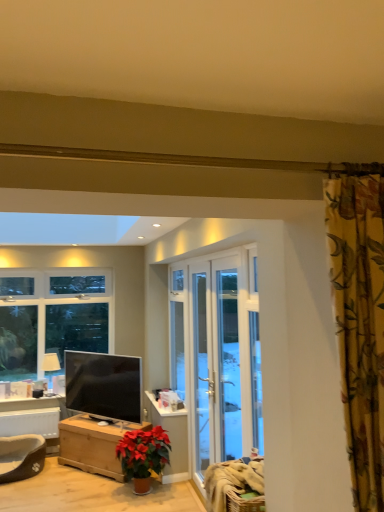
The image size is (384, 512). What do you see at coordinates (33, 418) in the screenshot?
I see `white painted wood table at lower left` at bounding box center [33, 418].

Describe the element at coordinates (21, 457) in the screenshot. The width and height of the screenshot is (384, 512). I see `dark brown plush pet bed at lower left` at that location.

Image resolution: width=384 pixels, height=512 pixels. What do you see at coordinates (93, 444) in the screenshot?
I see `wooden chest at lower left` at bounding box center [93, 444].

Measure the distance between white glass door at center, positioned as the first screen door in back-to-front order, and camera.

white glass door at center, positioned as the first screen door in back-to-front order, is 3.42 meters away from camera.

In order to face matte black tv at lower left, should I rotate leftwards or rightwards?

To face it directly, rotate left by 12.116 degrees.

You are a GUI agent. You are given a task and a screenshot of the screen. Output one action in this format:
    pyautogui.click(x=<x>, y=<y>)
    Task: Click on the matte black tv at lower left
    The height and width of the screenshot is (512, 384).
    Given the screenshot: What is the action you would take?
    pyautogui.click(x=104, y=385)

The width and height of the screenshot is (384, 512). What are the coordinates of `matte white lamp at left` in the screenshot? It's located at (50, 365).

Is dark brown plush pet bed at lower left to the left or to the right of matte white lamp at left in the image?

Based on their positions, dark brown plush pet bed at lower left is located to the left of matte white lamp at left.

Considering the sizes of objects dark brown plush pet bed at lower left and matte white lamp at left in the image provided, who is shorter, dark brown plush pet bed at lower left or matte white lamp at left?

Standing shorter between the two is dark brown plush pet bed at lower left.

Is dark brown plush pet bed at lower left not near matte white lamp at left?

dark brown plush pet bed at lower left is near matte white lamp at left, not far away.

From the image's perspective, is dark brown plush pet bed at lower left over matte white lamp at left?

No, from the image's perspective, dark brown plush pet bed at lower left is not on top of matte white lamp at left.

Is dark brown plush pet bed at lower left beside white glass door at center, the 2th screen door viewed from the front?

No, dark brown plush pet bed at lower left is not with white glass door at center, the 2th screen door viewed from the front.

Which of these two, dark brown plush pet bed at lower left or white glass door at center, positioned as the first screen door in back-to-front order, stands taller?

With more height is white glass door at center, positioned as the first screen door in back-to-front order.

Based on the photo, based on their sizes in the image, would you say dark brown plush pet bed at lower left is bigger or smaller than white glass door at center, positioned as the first screen door in back-to-front order?

In the image, dark brown plush pet bed at lower left appears to be smaller than white glass door at center, positioned as the first screen door in back-to-front order.

Does dark brown plush pet bed at lower left lie behind white glass door at center, positioned as the first screen door in back-to-front order?

Yes, the depth of dark brown plush pet bed at lower left is greater than that of white glass door at center, positioned as the first screen door in back-to-front order.

Who is bigger, wooden chest at lower left or dark brown plush pet bed at lower left?

wooden chest at lower left.

Is wooden chest at lower left situated inside dark brown plush pet bed at lower left or outside?

wooden chest at lower left is spatially situated outside dark brown plush pet bed at lower left.

From the image's perspective, is wooden chest at lower left beneath dark brown plush pet bed at lower left?

No, from the image's perspective, wooden chest at lower left is not below dark brown plush pet bed at lower left.

Considering the relative sizes of wooden chest at lower left and dark brown plush pet bed at lower left in the image provided, is wooden chest at lower left taller than dark brown plush pet bed at lower left?

Yes, wooden chest at lower left is taller than dark brown plush pet bed at lower left.

In the image, is white glass door at center, positioned as the first screen door in back-to-front order, positioned in front of or behind white painted wood table at lower left?

Visually, white glass door at center, positioned as the first screen door in back-to-front order, is located in front of white painted wood table at lower left.

From a real-world perspective, is white glass door at center, positioned as the first screen door in back-to-front order, positioned under white painted wood table at lower left based on gravity?

No, from a real-world perspective, white glass door at center, positioned as the first screen door in back-to-front order, is not beneath white painted wood table at lower left.

From the picture: In terms of size, does white glass door at center, the 2th screen door viewed from the front, appear bigger or smaller than white painted wood table at lower left?

Clearly, white glass door at center, the 2th screen door viewed from the front, is larger in size than white painted wood table at lower left.

How many degrees apart are the facing directions of white glass door at center, positioned as the first screen door in back-to-front order, and white painted wood table at lower left?

The facing directions of white glass door at center, positioned as the first screen door in back-to-front order, and white painted wood table at lower left are 89.8 degrees apart.

Is matte white lamp at left bigger than white painted wood table at lower left?

No.

Based on their positions, is matte white lamp at left located to the left or right of white painted wood table at lower left?

matte white lamp at left is to the right of white painted wood table at lower left.

Is the surface of matte white lamp at left in direct contact with white painted wood table at lower left?

No, matte white lamp at left is not in contact with white painted wood table at lower left.

Is point (45, 355) closer to camera compared to point (13, 432)?

No.

This screenshot has height=512, width=384. I want to click on lamp on the left of floral fabric curtain at upper right, so click(50, 365).

From the image's perspective, is matte white lamp at left located above floral fabric curtain at upper right?

No, from the image's perspective, matte white lamp at left is not over floral fabric curtain at upper right.

Is point (46, 357) closer or farther from the camera than point (349, 455)?

Clearly, point (46, 357) is more distant from the camera than point (349, 455).

Considering the relative positions of matte white lamp at left and floral fabric curtain at upper right in the image provided, is matte white lamp at left to the left or to the right of floral fabric curtain at upper right?

In the image, matte white lamp at left appears on the left side of floral fabric curtain at upper right.

Who is smaller, matte black tv at lower left or matte white lamp at left?

matte white lamp at left is smaller.

Is matte black tv at lower left surrounding matte white lamp at left?

That's incorrect, matte white lamp at left is not inside matte black tv at lower left.

Is matte black tv at lower left positioned in front of matte white lamp at left?

Yes, matte black tv at lower left is in front of matte white lamp at left.

From a real-world perspective, is matte black tv at lower left positioned above or below matte white lamp at left?

From a real-world perspective, matte black tv at lower left is physically below matte white lamp at left.

Identify the location of lamp behind the dark brown plush pet bed at lower left. Image resolution: width=384 pixels, height=512 pixels. (50, 365).

In the image, there is a white glass door at center, positioned as the first screen door in back-to-front order. Where is `swivel chair below it (from a real-world perspective)`? The height and width of the screenshot is (512, 384). swivel chair below it (from a real-world perspective) is located at coordinates (21, 457).

Estimate the real-world distances between objects in this image. Which object is closer to matte white lamp at left, white painted wood table at lower left or white glass door at center, the 2th screen door viewed from the front?

white painted wood table at lower left is closer to matte white lamp at left.

Based on their spatial positions, is white glass door at center, the 2th screen door viewed from the front, or matte black tv at lower left closer to dark brown plush pet bed at lower left?

The object closer to dark brown plush pet bed at lower left is matte black tv at lower left.

From the image, which object appears to be farther from white glass door at center, marked as the 2th screen door in a back-to-front arrangement, white glass door at center, positioned as the first screen door in back-to-front order, or white painted wood table at lower left?

Among the two, white painted wood table at lower left is located further to white glass door at center, marked as the 2th screen door in a back-to-front arrangement.

Looking at the image, which one is located closer to floral fabric curtain at upper right, matte white lamp at left or dark brown plush pet bed at lower left?

dark brown plush pet bed at lower left is closer to floral fabric curtain at upper right.

Estimate the real-world distances between objects in this image. Which object is closer to white painted wood table at lower left, white glass door at center, which appears as the first screen door when viewed from the front, or matte white lamp at left?

Among the two, matte white lamp at left is located nearer to white painted wood table at lower left.

Estimate the real-world distances between objects in this image. Which object is closer to dark brown plush pet bed at lower left, white glass door at center, positioned as the first screen door in back-to-front order, or wooden chest at lower left?

Among the two, wooden chest at lower left is located nearer to dark brown plush pet bed at lower left.

When comparing their distances from white glass door at center, the 2th screen door viewed from the front, does dark brown plush pet bed at lower left or white glass door at center, marked as the 2th screen door in a back-to-front arrangement, seem closer?

white glass door at center, marked as the 2th screen door in a back-to-front arrangement, is positioned closer to the anchor white glass door at center, the 2th screen door viewed from the front.

Considering their positions, is white glass door at center, which appears as the first screen door when viewed from the front, positioned closer to white painted wood table at lower left than dark brown plush pet bed at lower left?

The object closer to white painted wood table at lower left is dark brown plush pet bed at lower left.

Where is `desk located between white glass door at center, marked as the 2th screen door in a back-to-front arrangement, and white painted wood table at lower left in the depth direction`? The image size is (384, 512). desk located between white glass door at center, marked as the 2th screen door in a back-to-front arrangement, and white painted wood table at lower left in the depth direction is located at coordinates (93, 444).

The height and width of the screenshot is (512, 384). In order to click on lamp located between dark brown plush pet bed at lower left and white glass door at center, positioned as the first screen door in back-to-front order, in the left-right direction in this screenshot , I will do `click(50, 365)`.

The width and height of the screenshot is (384, 512). Identify the location of television between floral fabric curtain at upper right and white painted wood table at lower left in the front-back direction. (104, 385).

Find the location of a particular element. Image resolution: width=384 pixels, height=512 pixels. desk situated between dark brown plush pet bed at lower left and white glass door at center, which appears as the first screen door when viewed from the front, from left to right is located at coordinates (93, 444).